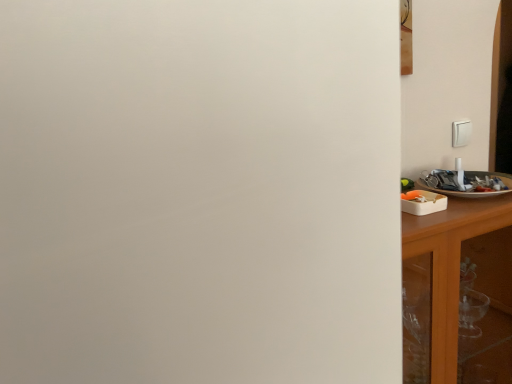
Question: From the image's perspective, is wooden cabinet at right above or below white glossy plate at right?

Choices:
 (A) below
 (B) above

Answer: (A)

Question: Considering the positions of wooden cabinet at right and white glossy plate at right in the image, is wooden cabinet at right taller or shorter than white glossy plate at right?

Choices:
 (A) tall
 (B) short

Answer: (A)

Question: Visually, is wooden cabinet at right positioned to the left or to the right of white glossy plate at right?

Choices:
 (A) left
 (B) right

Answer: (A)

Question: Is white glossy plate at right inside or outside of wooden cabinet at right?

Choices:
 (A) inside
 (B) outside

Answer: (B)

Question: From the image's perspective, is white glossy plate at right positioned above or below wooden cabinet at right?

Choices:
 (A) above
 (B) below

Answer: (A)

Question: From a real-world perspective, is white glossy plate at right positioned above or below wooden cabinet at right?

Choices:
 (A) above
 (B) below

Answer: (A)

Question: In terms of width, does white glossy plate at right look wider or thinner when compared to wooden cabinet at right?

Choices:
 (A) thin
 (B) wide

Answer: (A)